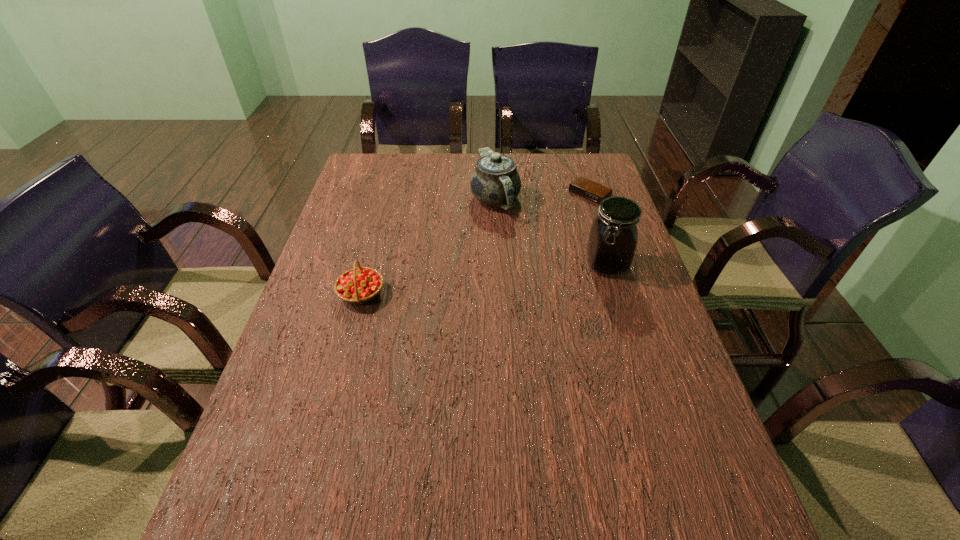
This screenshot has width=960, height=540. Find the location of `the third tallest object`. the third tallest object is located at coordinates (361, 285).

Locate an element on the screen. The image size is (960, 540). strawberry is located at coordinates (361, 285).

This screenshot has height=540, width=960. What are the coordinates of `jar` in the screenshot? It's located at (613, 237).

You are a GUI agent. You are given a task and a screenshot of the screen. Output one action in this format:
    pyautogui.click(x=<x>, y=<y>)
    Task: Click on the alarm clock
    
    Given the screenshot: What is the action you would take?
    pyautogui.click(x=583, y=187)

Identify the location of chinaware. (495, 181).

The height and width of the screenshot is (540, 960). Identify the location of the third object from right to left. (495, 181).

The width and height of the screenshot is (960, 540). Find the location of `free region located on the front of the leftmost object`. free region located on the front of the leftmost object is located at coordinates (313, 474).

Find the location of a particular element. Image resolution: width=960 pixels, height=540 pixels. vacant region located on the lid of the jar is located at coordinates (627, 330).

Locate an element on the screen. The image size is (960, 540). vacant space located 0.210m on the front face of the shortest object is located at coordinates (539, 232).

Locate an element on the screen. The image size is (960, 540). free space located 0.150m on the front face of the shortest object is located at coordinates coord(550,223).